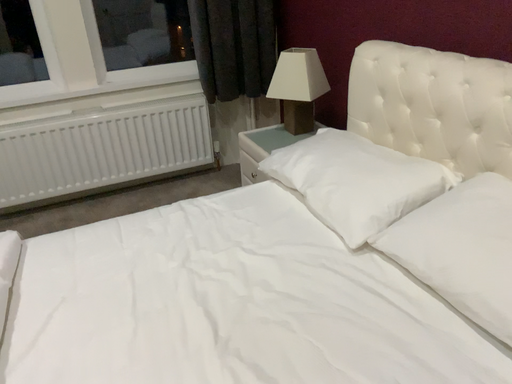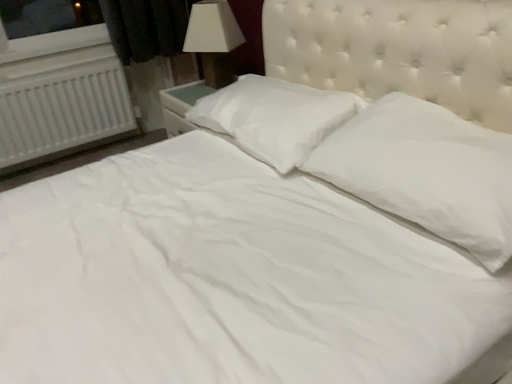
Question: How did the camera likely rotate when shooting the video?

Choices:
 (A) rotated right
 (B) rotated left

Answer: (A)